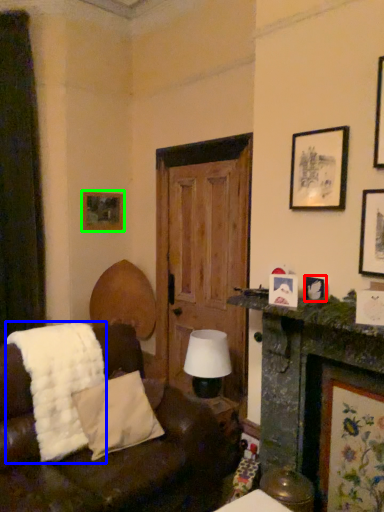
Question: Which is farther away from picture frame (highlighted by a red box)? blanket (highlighted by a blue box) or picture frame (highlighted by a green box)?

Choices:
 (A) blanket
 (B) picture frame

Answer: (B)